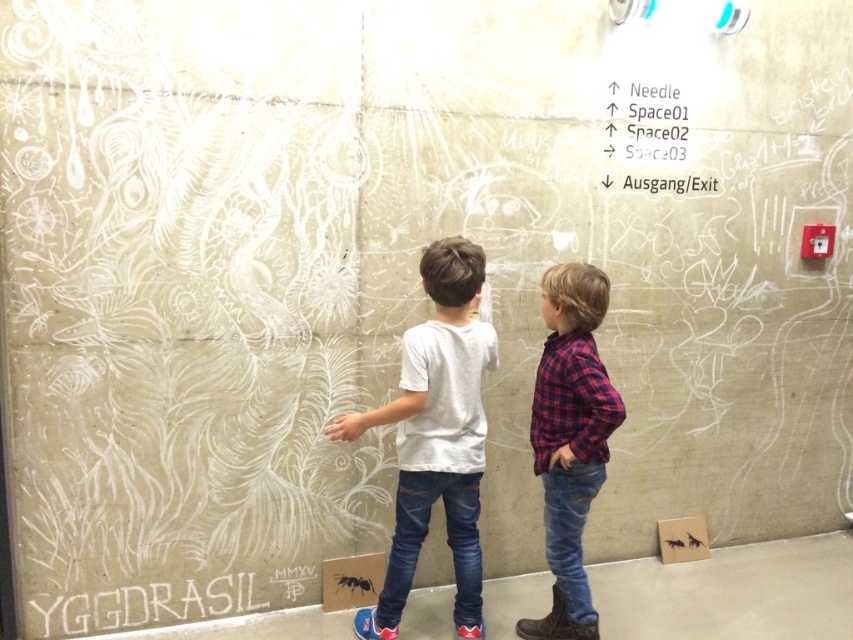
Question: Is white chalk writing at lower left closer to the viewer compared to white chalk writing at upper center?

Choices:
 (A) yes
 (B) no

Answer: (A)

Question: Does white matte shirt at center come behind plaid fabric shirt at center?

Choices:
 (A) no
 (B) yes

Answer: (A)

Question: Which point is closer to the camera?

Choices:
 (A) (119, 598)
 (B) (387, 579)
 (C) (561, 420)

Answer: (C)

Question: Can you confirm if white matte shirt at center is positioned to the right of white chalk writing at upper center?

Choices:
 (A) yes
 (B) no

Answer: (B)

Question: Which point is farther to the camera?

Choices:
 (A) (445, 388)
 (B) (80, 605)
 (C) (604, 140)

Answer: (C)

Question: Which point is closer to the camera taking this photo?

Choices:
 (A) (461, 353)
 (B) (596, 637)
 (C) (701, 188)
 (D) (236, 572)

Answer: (A)